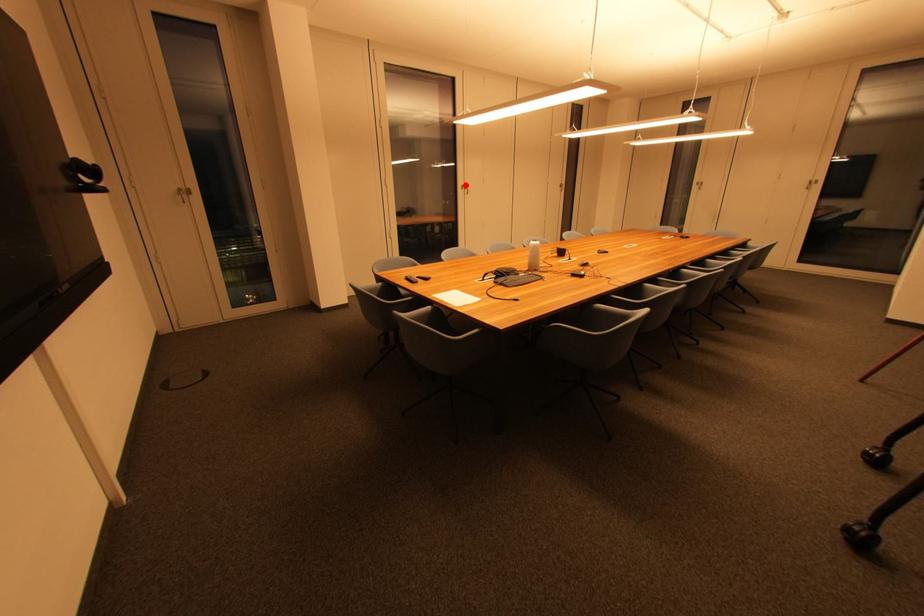
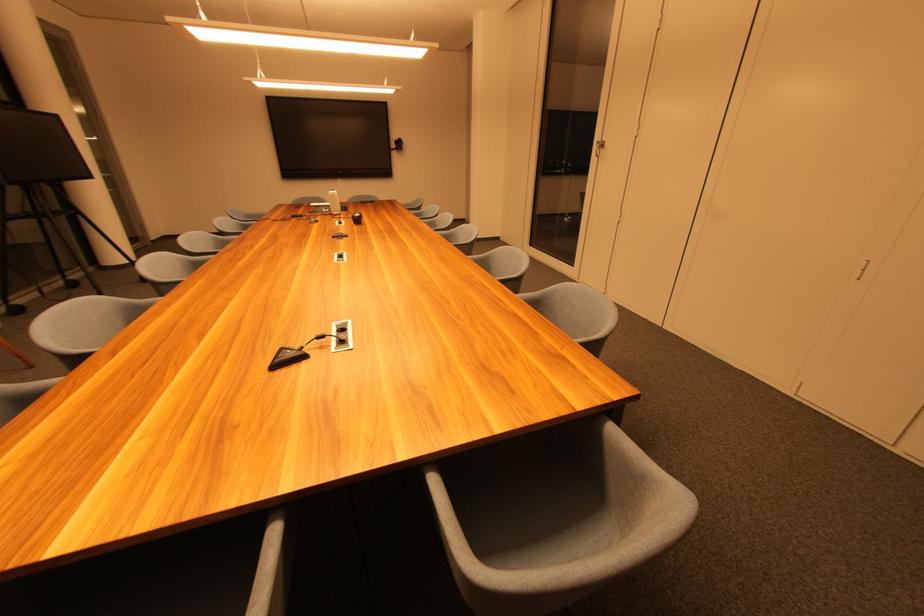
In the second image, find the point that corresponds to the highlighted location in the first image.

(602, 140)